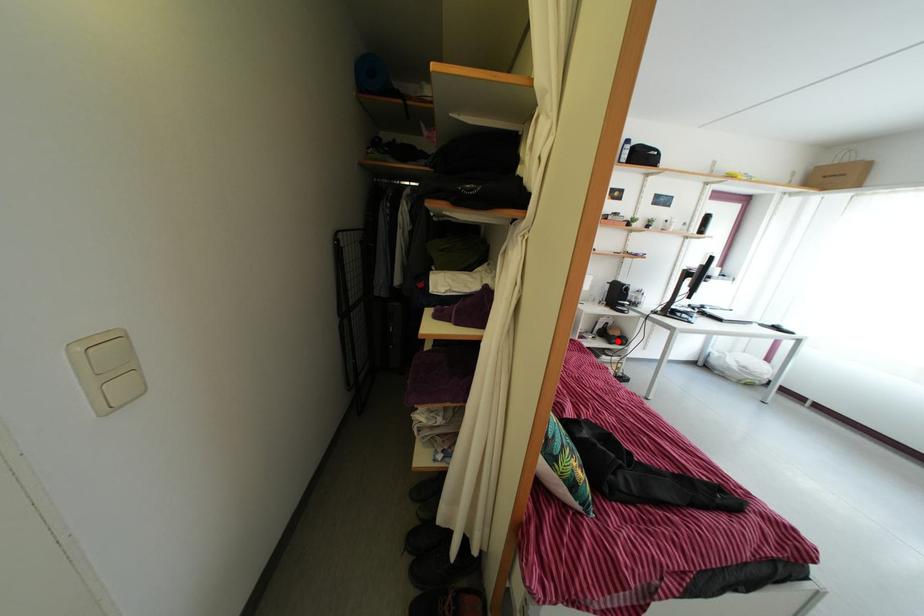
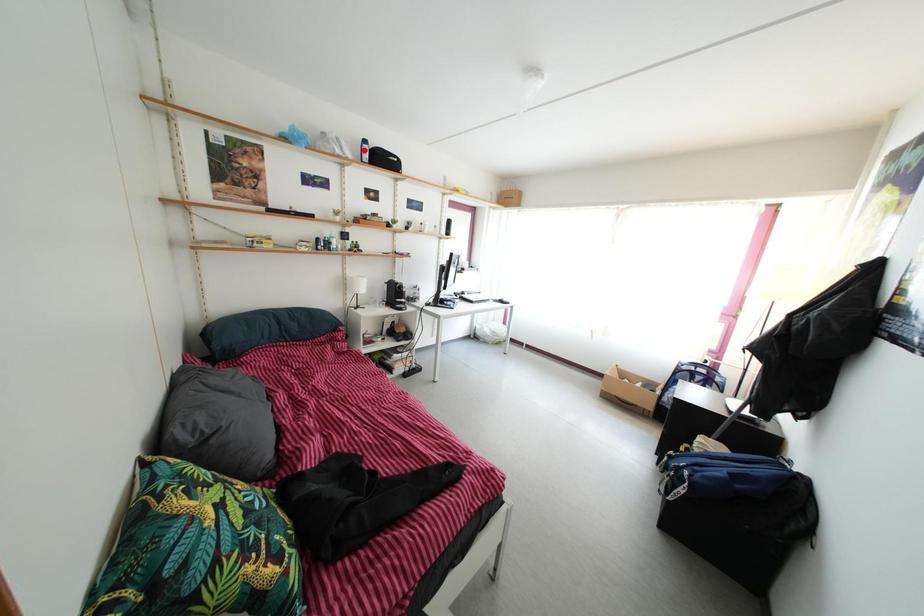
I am providing you with two images of the same scene from different viewpoints. A red point is marked on the first image and another point is marked on the second image. Do the highlighted points in image1 and image2 indicate the same real-world spot?

No